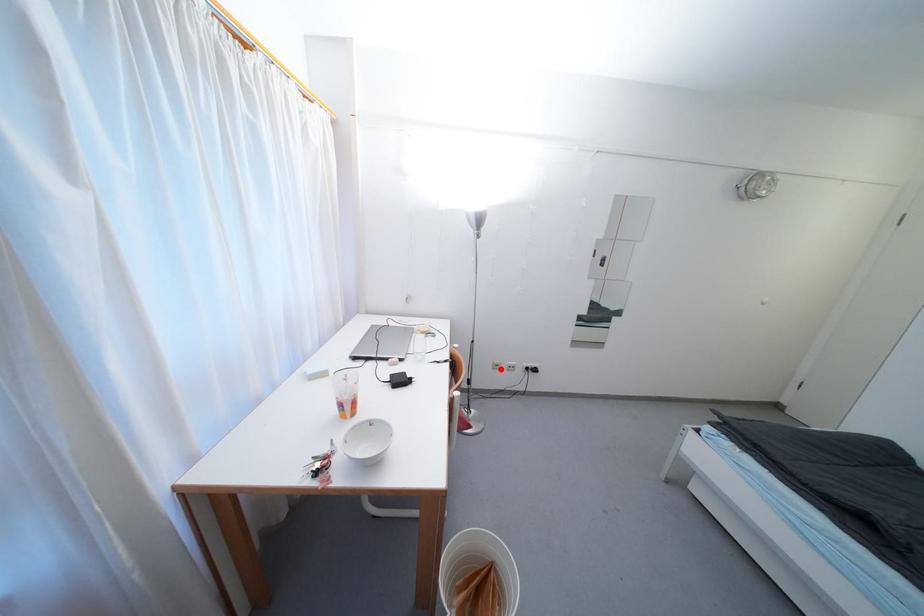
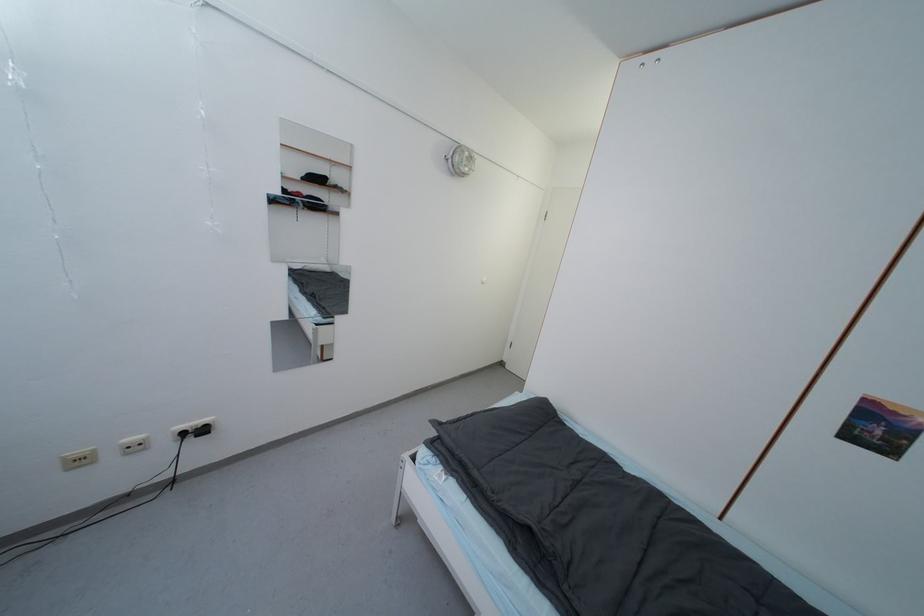
The point at the highlighted location is marked in the first image. Where is the corresponding point in the second image?

(83, 464)